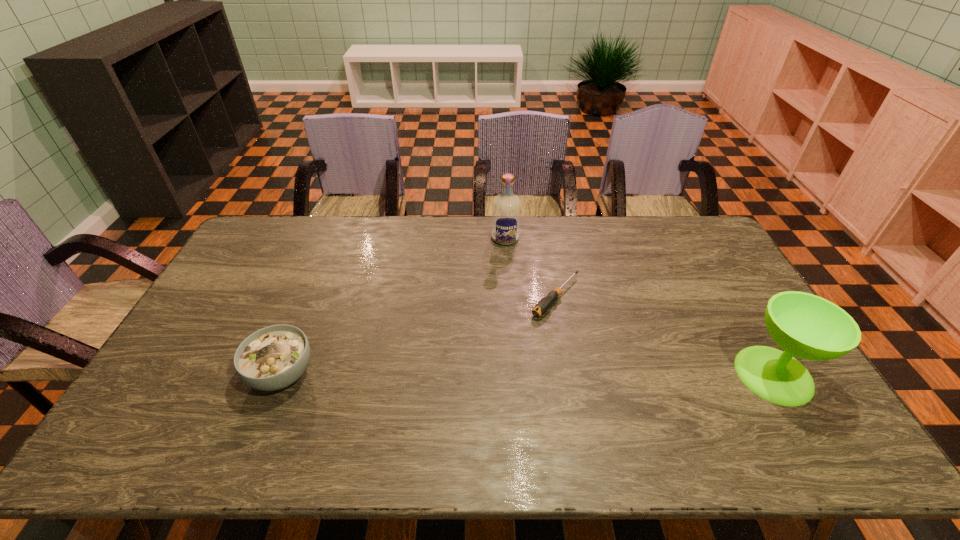
At what (x,y) coordinates should I click in order to perform the action: click on vacant space that satisfies the following two spatial constraints: 1. on the front side of the shortest object; 2. on the right side of the rightmost object. Please return your answer as a coordinate pair (x, y). The image size is (960, 540). Looking at the image, I should click on (570, 375).